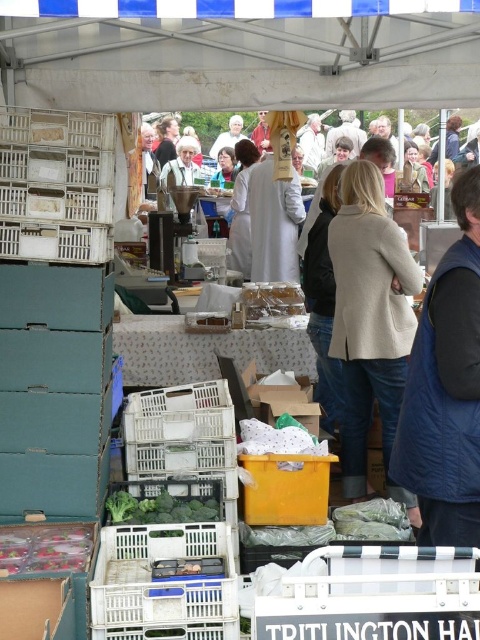
You are a vendor at the market and need to access the contents of the white plastic crate at lower left. Can you easily reach it without moving the white plastic crate at left?

The white plastic crate at left is positioned over the white plastic crate at lower left, so you cannot easily reach the lower crate without moving the one on top.